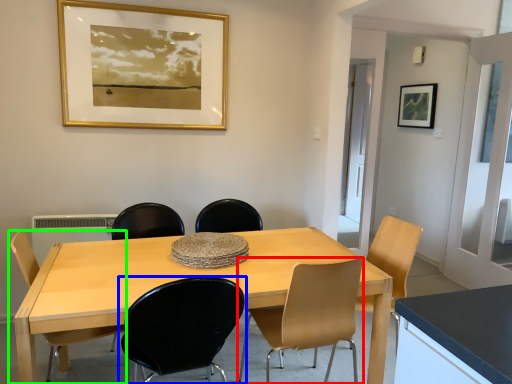
Question: Which object is positioned farthest from chair (highlighted by a red box)? Select from chair (highlighted by a blue box) and chair (highlighted by a green box).

Choices:
 (A) chair
 (B) chair

Answer: (B)